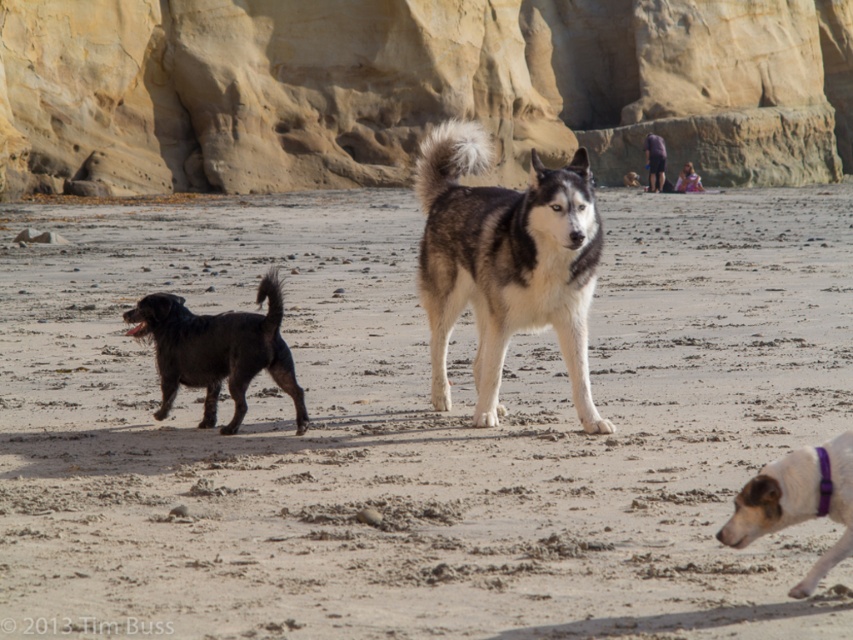
Can you confirm if black fur dog at left is positioned to the left of white fur dog at lower right?

Yes, black fur dog at left is to the left of white fur dog at lower right.

Can you confirm if black fur dog at left is positioned to the right of white fur dog at lower right?

No, black fur dog at left is not to the right of white fur dog at lower right.

This screenshot has width=853, height=640. What do you see at coordinates (218, 349) in the screenshot? I see `black fur dog at left` at bounding box center [218, 349].

Find the location of a particular element. This screenshot has width=853, height=640. black fur dog at left is located at coordinates (218, 349).

Which of these two, white fur husky at center or black fur dog at left, stands taller?

white fur husky at center is taller.

Can you confirm if white fur husky at center is taller than black fur dog at left?

Correct, white fur husky at center is much taller as black fur dog at left.

Is point (595, 282) positioned before point (228, 314)?

That is True.

The width and height of the screenshot is (853, 640). What are the coordinates of `white fur husky at center` in the screenshot? It's located at (505, 260).

Is sandy beach at center to the left of smooth sandstone cliff at upper center from the viewer's perspective?

Correct, you'll find sandy beach at center to the left of smooth sandstone cliff at upper center.

Is point (161, 568) more distant than point (618, 140)?

No.

Image resolution: width=853 pixels, height=640 pixels. Find the location of `sandy beach at center`. sandy beach at center is located at coordinates (418, 428).